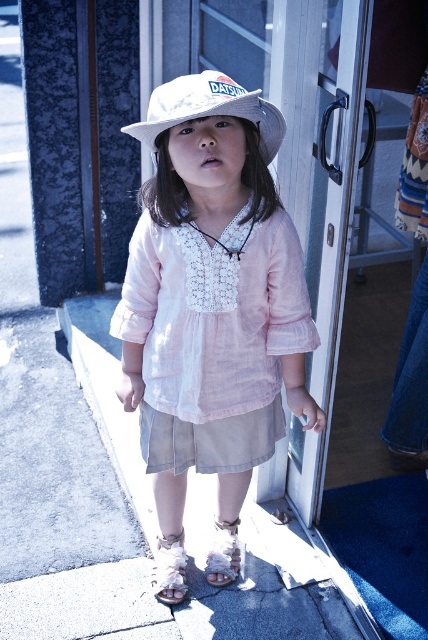
You are a photographer taking a picture of the matte white hat at center and the white fabric sandal at lower center. Which object will appear larger in the photo?

The matte white hat at center will appear larger in the photo because it is closer to the viewer than the white fabric sandal at lower center.

You are a photographer setting up a shoot in the scene described. You need to place a small prop exactly at point (x=208, y=109). What object is located there?

The white straw hat at center is located at point (x=208, y=109).